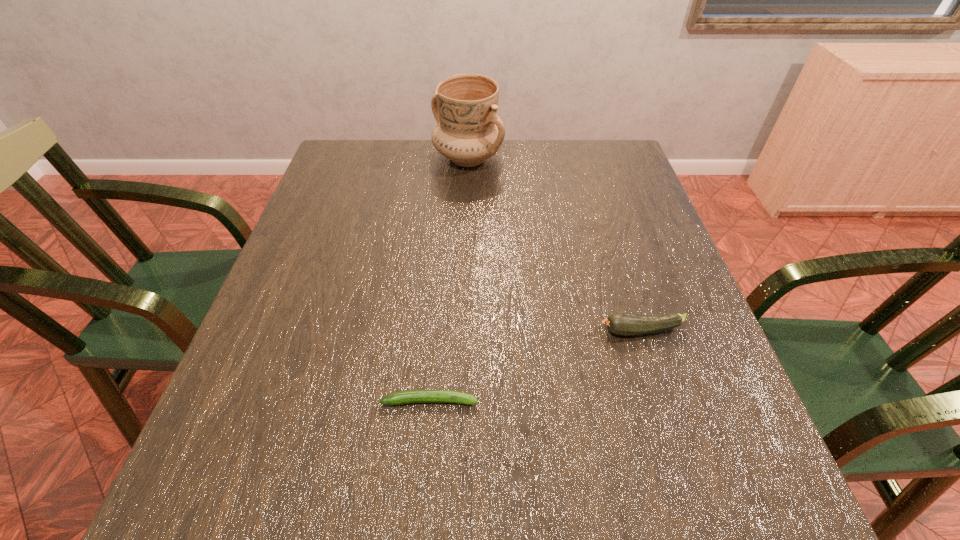
Where is `vacant space located 0.380m on the front-facing side of the shortest object`? vacant space located 0.380m on the front-facing side of the shortest object is located at coordinates (699, 401).

The width and height of the screenshot is (960, 540). I want to click on object that is positioned at the far edge, so click(469, 131).

Where is `object positioned at the right edge`? The height and width of the screenshot is (540, 960). object positioned at the right edge is located at coordinates (625, 324).

The width and height of the screenshot is (960, 540). In the image, there is a desktop. In order to click on free region at the far edge in this screenshot , I will do `click(567, 140)`.

In the image, there is a desktop. Where is `blank space at the near edge`? blank space at the near edge is located at coordinates (616, 521).

Image resolution: width=960 pixels, height=540 pixels. Identify the location of free location at the left edge. (214, 417).

Find the location of a particular element. The width and height of the screenshot is (960, 540). vacant point at the right edge is located at coordinates (702, 376).

Locate an element on the screen. This screenshot has width=960, height=540. free space at the near left corner is located at coordinates (207, 504).

Locate an element on the screen. free region at the far right corner of the desktop is located at coordinates (583, 163).

You are a GUI agent. You are given a task and a screenshot of the screen. Output one action in this format:
    pyautogui.click(x=<x>, y=<y>)
    Task: Click on the free point between the rightmost object and the pottery
    
    Given the screenshot: What is the action you would take?
    pyautogui.click(x=554, y=245)